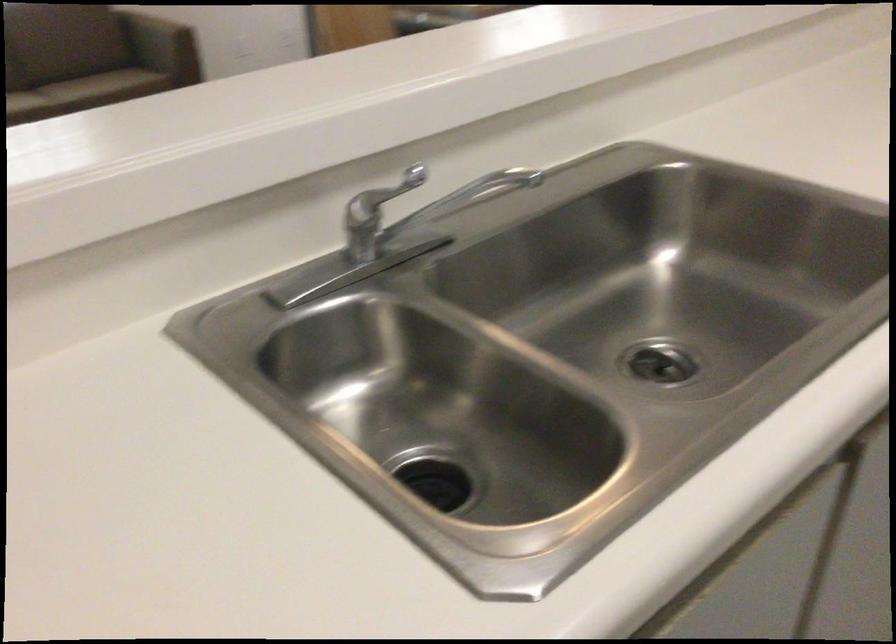
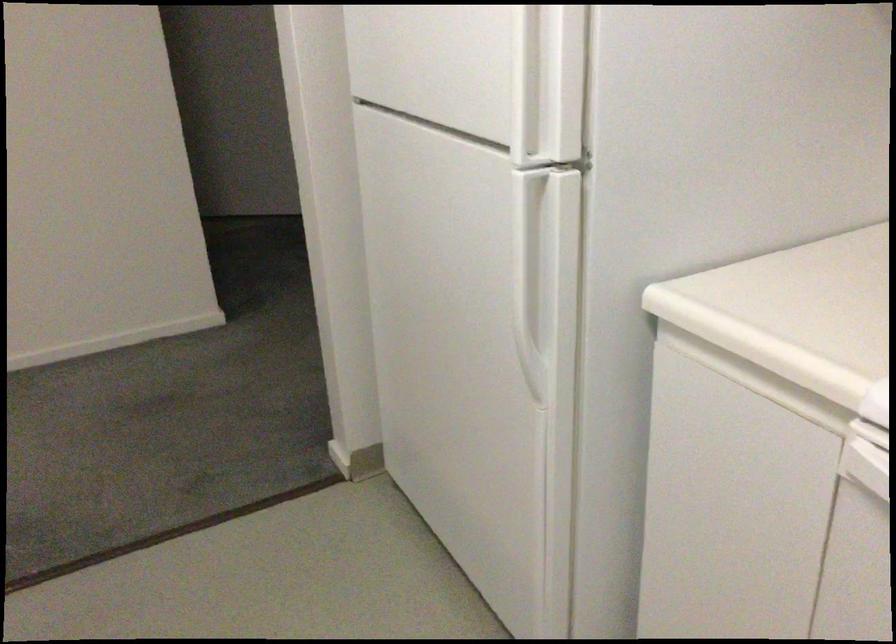
Question: The camera is either moving clockwise (left) or counter-clockwise (right) around the object. The first image is from the beginning of the video and the second image is from the end. Is the camera moving left or right when shooting the video?

Choices:
 (A) Left
 (B) Right

Answer: (A)